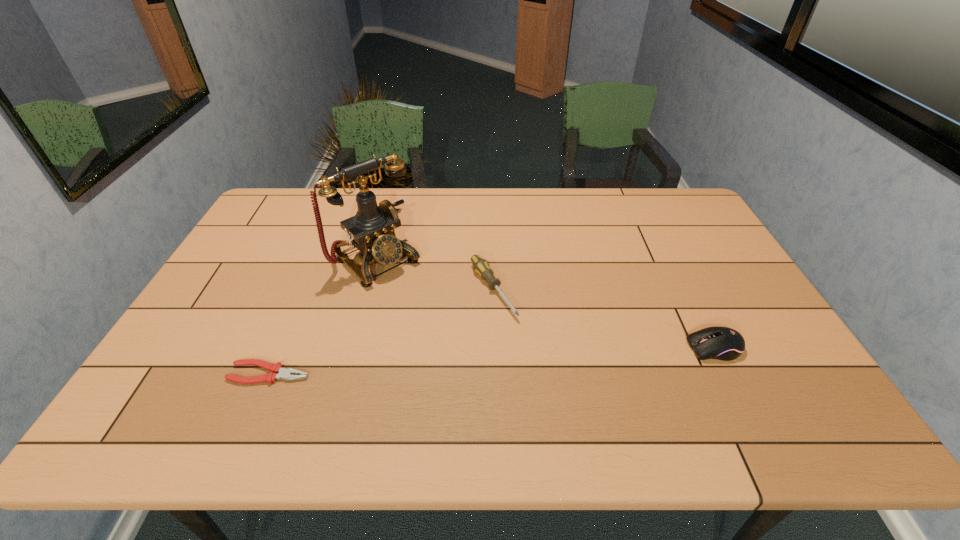
Where is `the shortest object`? This screenshot has height=540, width=960. the shortest object is located at coordinates (283, 373).

At what (x,y) coordinates should I click in order to perform the action: click on the rightmost object. Please return your answer as a coordinate pair (x, y). Looking at the image, I should click on (722, 343).

Where is `the tallest object`? the tallest object is located at coordinates (372, 230).

This screenshot has height=540, width=960. In order to click on screwdriver in this screenshot , I will do `click(480, 266)`.

Locate an element on the screen. the third tallest object is located at coordinates (480, 266).

The height and width of the screenshot is (540, 960). What are the coordinates of `vacant space located on the back of the pliers` in the screenshot? It's located at (310, 278).

The image size is (960, 540). What are the coordinates of `vacant space located on the front of the rightmost object` in the screenshot? It's located at (730, 379).

This screenshot has width=960, height=540. I want to click on vacant space located on the front of the telephone, featuring the rotary dial, so click(421, 301).

Find the location of a particular element. The image size is (960, 540). vacant space located 0.290m on the front of the telephone, featuring the rotary dial is located at coordinates (x=464, y=340).

Find the location of `free space located 0.240m on the front of the telephone, featuring the rotary dial`. free space located 0.240m on the front of the telephone, featuring the rotary dial is located at coordinates (452, 329).